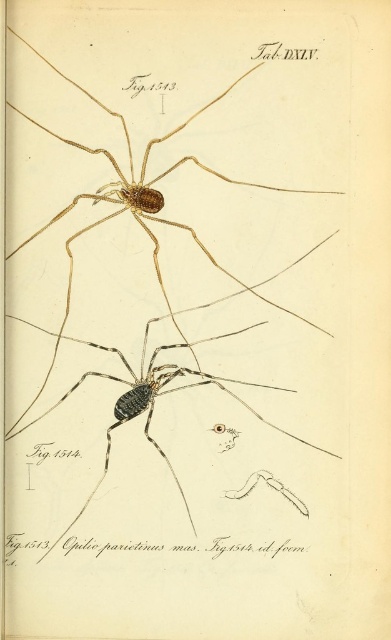
You are examining the scientific illustration of arachnids. You see a brown matte spider at upper center and a dark brown matte spider at center. Which one is positioned to the right of the other?

The brown matte spider at upper center is to the right of the dark brown matte spider at center.

You are an entomologist examining the page. You notice the brown matte spider at upper center and the dark brown matte spider at center. Which one has a smaller width?

The brown matte spider at upper center has a smaller width than the dark brown matte spider at center.